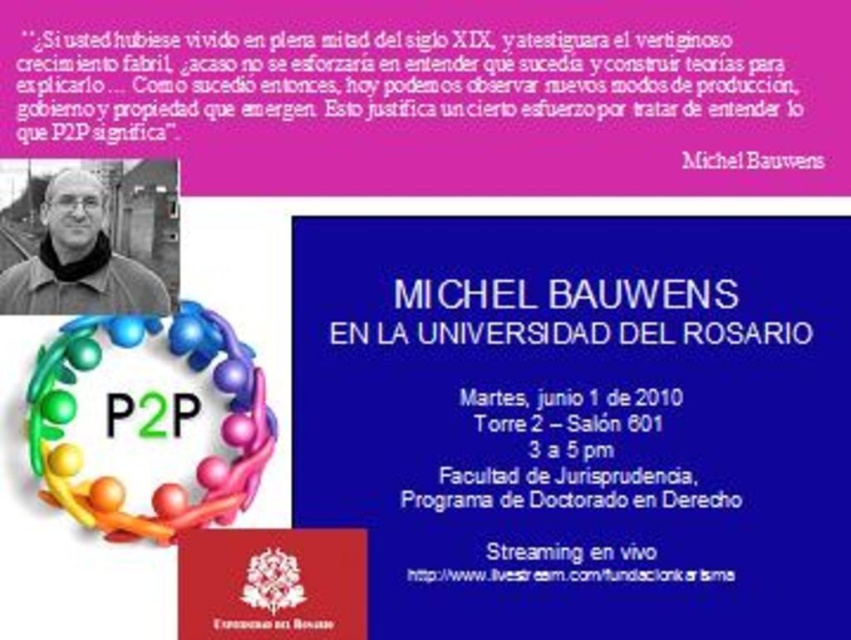
Question: Does pink paper at upper center appear on the right side of matte black jacket at upper left?

Choices:
 (A) yes
 (B) no

Answer: (A)

Question: Which of the following is the closest to the observer?

Choices:
 (A) white text on blue background at center
 (B) black paper at upper center
 (C) matte black jacket at upper left
 (D) pink paper at upper center

Answer: (D)

Question: Which is farther from the white text on blue background at center?

Choices:
 (A) matte black jacket at upper left
 (B) pink paper at upper center

Answer: (A)

Question: Can you confirm if pink paper at upper center is thinner than black paper at upper center?

Choices:
 (A) yes
 (B) no

Answer: (B)

Question: Is pink paper at upper center smaller than white text on blue background at center?

Choices:
 (A) no
 (B) yes

Answer: (A)

Question: Based on their relative distances, which object is farther from the white text on blue background at center?

Choices:
 (A) matte black jacket at upper left
 (B) black paper at upper center

Answer: (A)